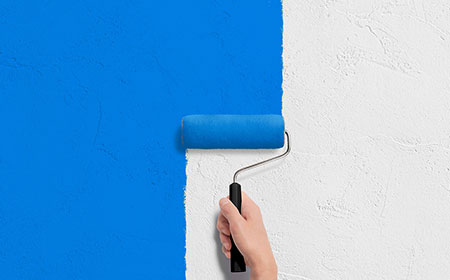
The width and height of the screenshot is (450, 280). Find the location of `white textured wall`. white textured wall is located at coordinates (399, 63).